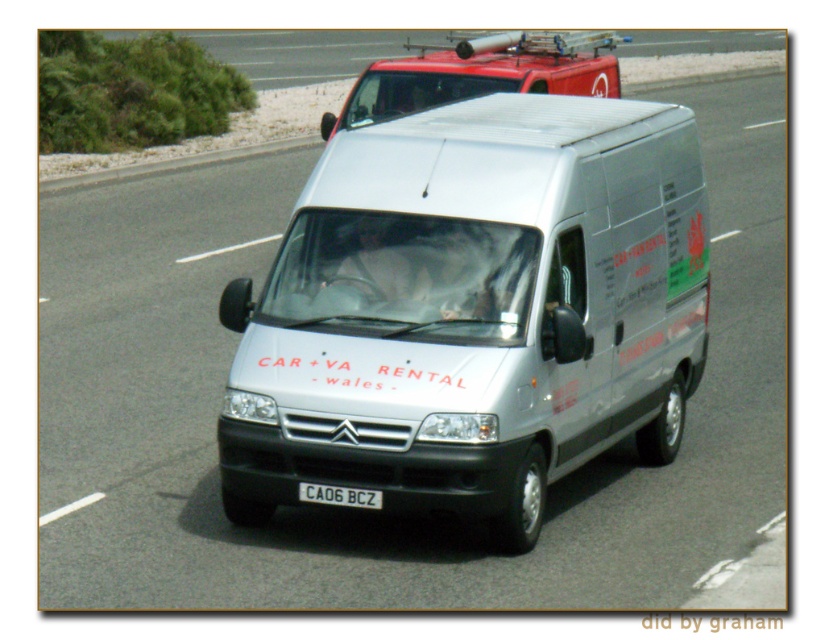
You are a passenger in the white van and want to know which of the two points, point (429, 278) or point (357, 497), is closer to you. Based on the scene, can you determine this?

Point (429, 278) is closer to you than point (357, 497) because it is further to the viewer.

You are a driver in the white van and want to change lanes to the left. There is a red matte van at upper center represented by point (479,74). Is there enough space to safely change lanes to the left without crossing the white lane lines?

The red matte van at upper center represented by point (479,74) is located at upper center, so changing lanes to the left might not be safe as it could lead to crossing the white lane lines. Please check the surroundings carefully before making any maneuver.